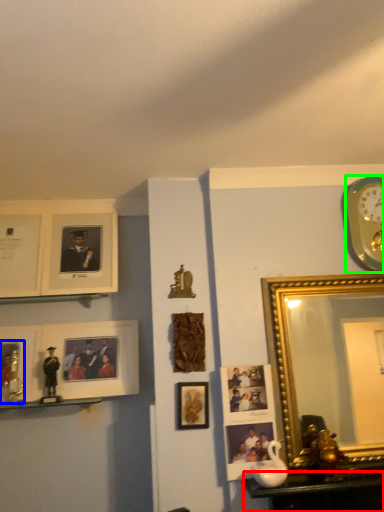
Question: Estimate the real-world distances between objects in this image. Which object is farther from table (highlighted by a red box), picture frame (highlighted by a blue box) or wall clock (highlighted by a green box)?

Choices:
 (A) picture frame
 (B) wall clock

Answer: (A)